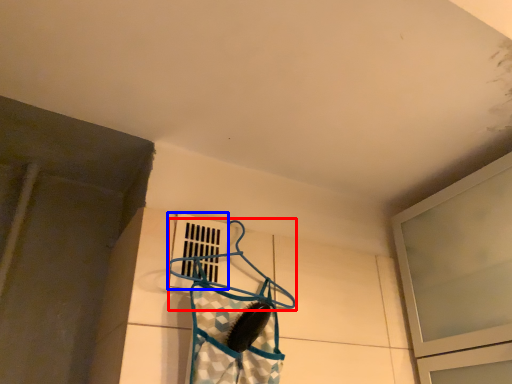
Question: Which object appears closest to the camera in this image, hanger (highlighted by a red box) or window (highlighted by a blue box)?

Choices:
 (A) hanger
 (B) window

Answer: (A)